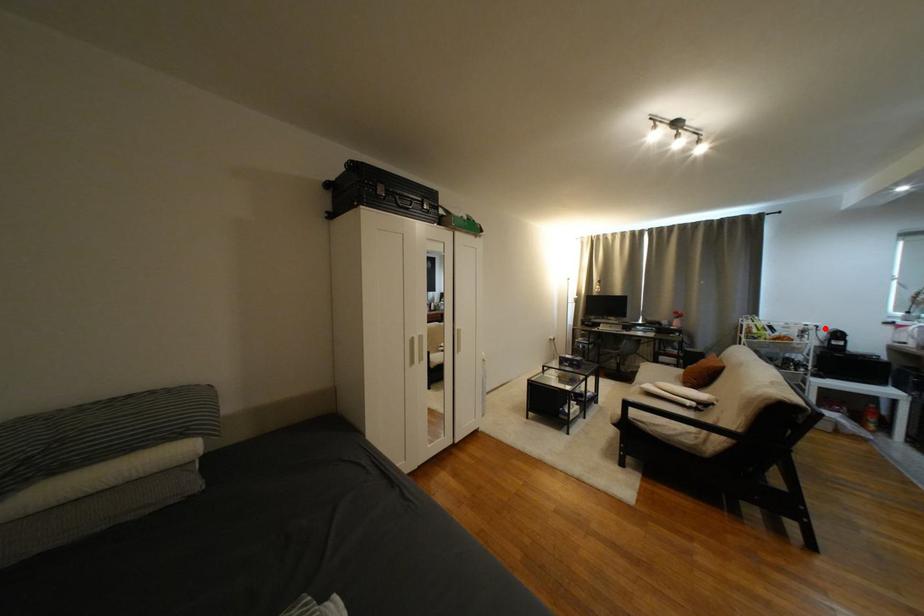
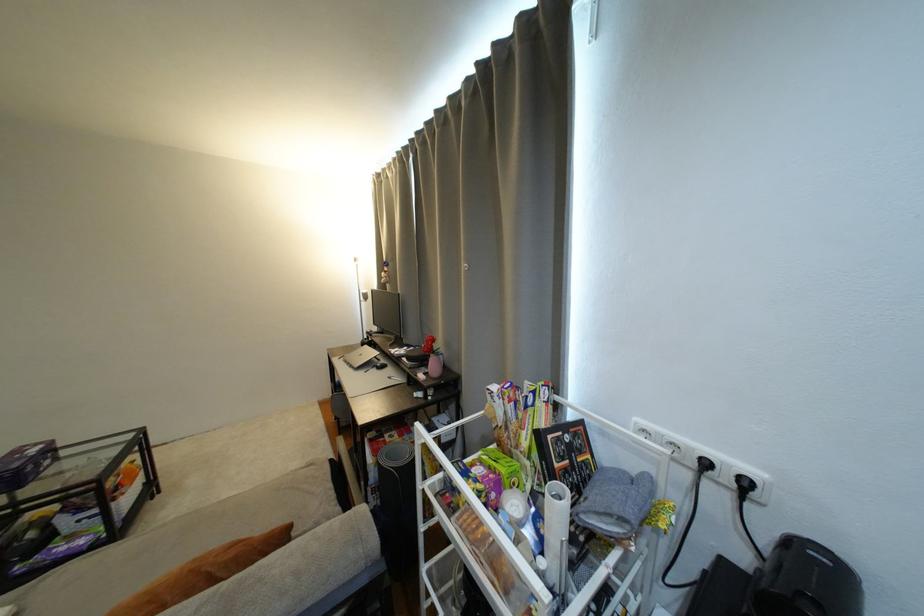
Find the pixel in the second image that matches the highlighted location in the first image.

(754, 485)